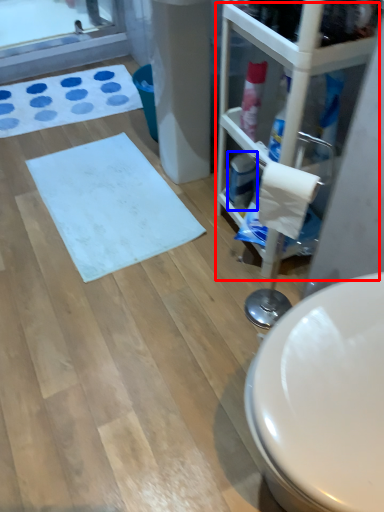
Question: Which object appears farthest to the camera in this image, glass door (highlighted by a red box) or cleaning product (highlighted by a blue box)?

Choices:
 (A) glass door
 (B) cleaning product

Answer: (B)